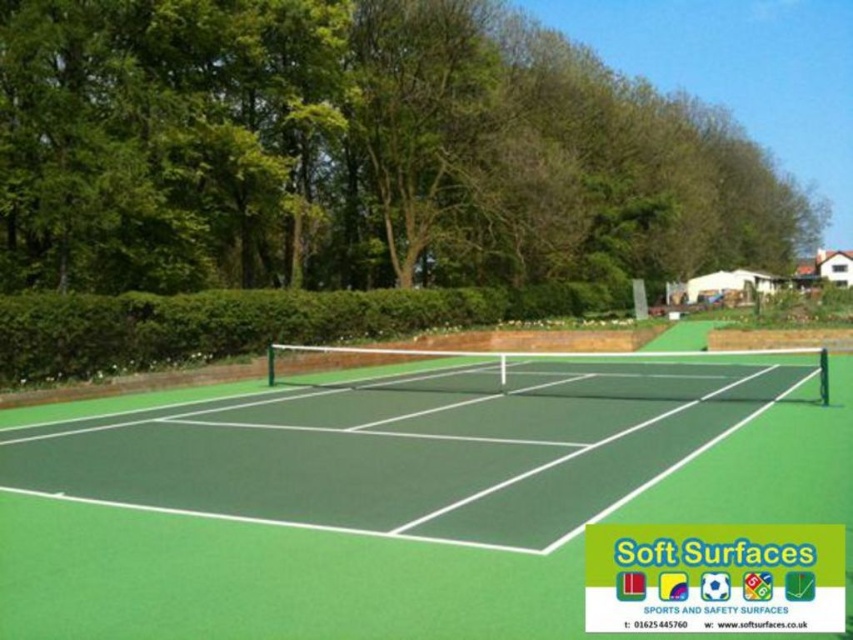
Question: From the image, what is the correct spatial relationship of green leafy tree at upper center in relation to green rubber tennis court at center?

Choices:
 (A) above
 (B) below

Answer: (A)

Question: Does green leafy tree at upper center have a smaller size compared to green rubber tennis court at center?

Choices:
 (A) no
 (B) yes

Answer: (A)

Question: Which of the following is the farthest from the observer?

Choices:
 (A) green rubber tennis court at center
 (B) green leafy tree at upper center

Answer: (B)

Question: Which point is closer to the camera?

Choices:
 (A) (711, 500)
 (B) (320, 180)

Answer: (A)

Question: Which point is closer to the camera taking this photo?

Choices:
 (A) 210,461
 (B) 796,234

Answer: (A)

Question: Does green leafy tree at upper center appear on the right side of green rubber tennis court at center?

Choices:
 (A) yes
 (B) no

Answer: (A)